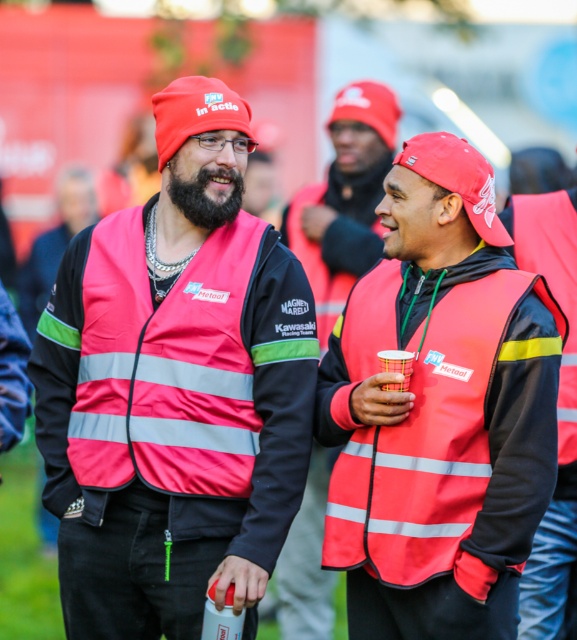
Is reflective fabric safety vest at center bigger than reflective red vest at center?

Correct, reflective fabric safety vest at center is larger in size than reflective red vest at center.

The image size is (577, 640). In order to click on reflective fabric safety vest at center in this screenshot , I will do `click(443, 428)`.

I want to click on reflective fabric safety vest at center, so click(443, 428).

Find the location of a particular element. The width and height of the screenshot is (577, 640). reflective fabric safety vest at center is located at coordinates (443, 428).

Describe the element at coordinates (443, 428) in the screenshot. I see `reflective fabric safety vest at center` at that location.

The image size is (577, 640). Describe the element at coordinates (443, 428) in the screenshot. I see `reflective fabric safety vest at center` at that location.

Identify the location of reflective fabric safety vest at center. The height and width of the screenshot is (640, 577). (443, 428).

Between reflective fabric safety vest at center and reflective fabric life jacket at center, which one appears on the left side from the viewer's perspective?

Positioned to the left is reflective fabric safety vest at center.

Is reflective fabric safety vest at center wider than reflective fabric life jacket at center?

Correct, the width of reflective fabric safety vest at center exceeds that of reflective fabric life jacket at center.

This screenshot has width=577, height=640. Identify the location of reflective fabric safety vest at center. (443, 428).